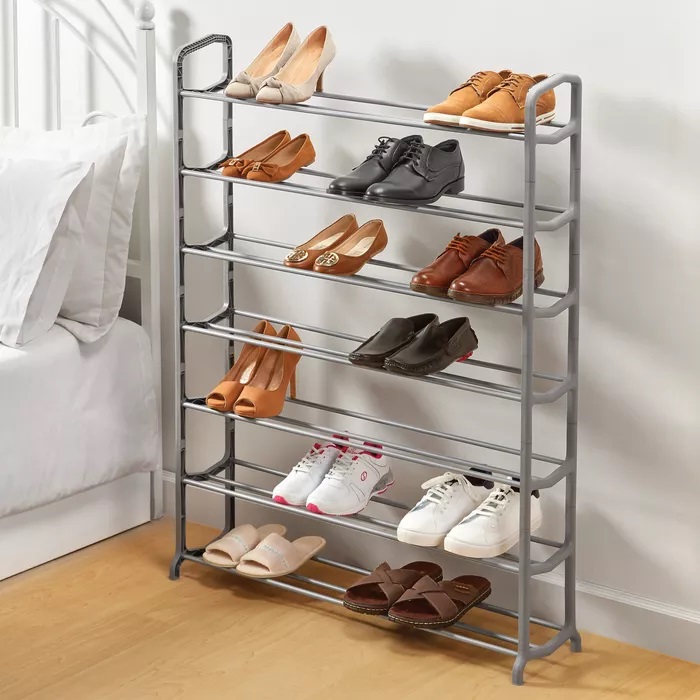
This screenshot has width=700, height=700. I want to click on shoe on sixth shelf down, so click(x=286, y=491), click(x=335, y=502), click(x=423, y=523), click(x=474, y=545).